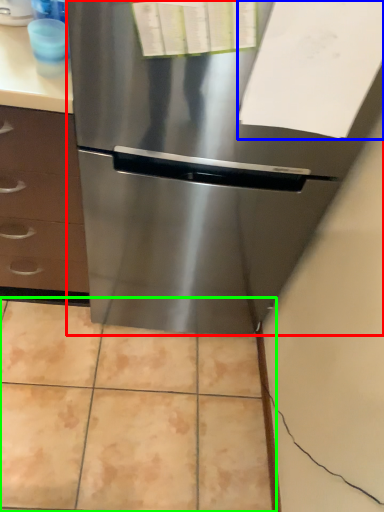
Question: Considering the real-world distances, which object is farthest from refrigerator (highlighted by a red box)? paper (highlighted by a blue box) or ceramic tile (highlighted by a green box)?

Choices:
 (A) paper
 (B) ceramic tile

Answer: (B)